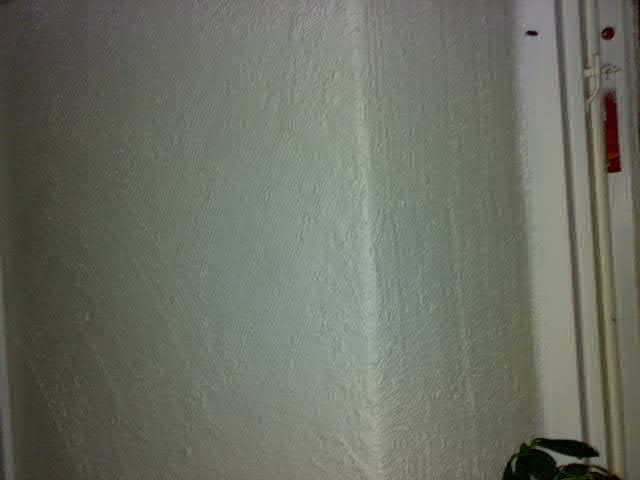
Find the location of `red rectangle in the molding`. red rectangle in the molding is located at coordinates (608, 122), (611, 128).